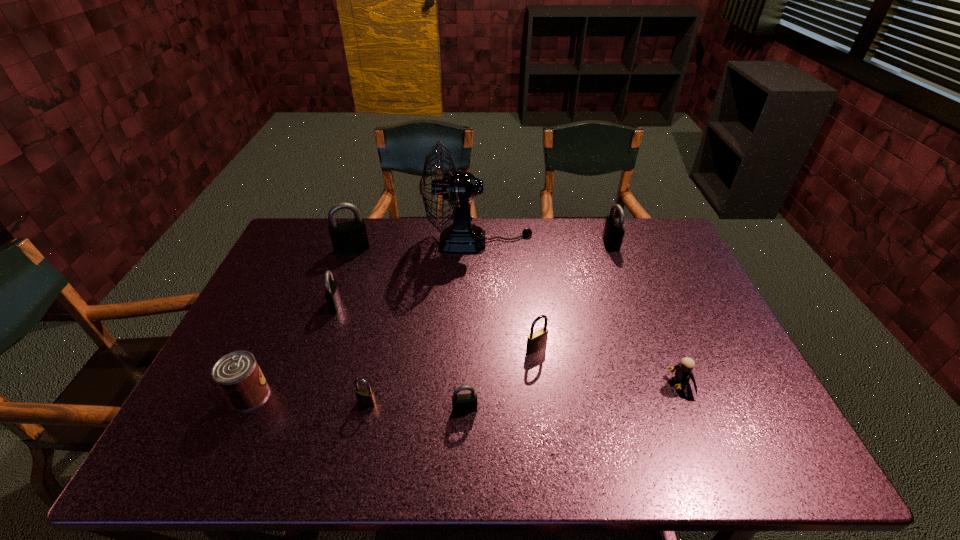
The image size is (960, 540). I want to click on black padlock that is the closest to the fourth farthest padlock, so click(464, 403).

At what (x,y) coordinates should I click in order to perform the action: click on vacant space that satisfies the following two spatial constraints: 1. on the back side of the rightmost black padlock; 2. on the right side of the bigger brass padlock. Please return your answer as a coordinate pair (x, y). Looking at the image, I should click on (523, 244).

The width and height of the screenshot is (960, 540). Find the location of `vacant space that satisfies the following two spatial constraints: 1. on the front side of the eighth shortest object; 2. on the right side of the farther brass padlock`. vacant space that satisfies the following two spatial constraints: 1. on the front side of the eighth shortest object; 2. on the right side of the farther brass padlock is located at coordinates (317, 348).

You are a GUI agent. You are given a task and a screenshot of the screen. Output one action in this format:
    pyautogui.click(x=<x>, y=<y>)
    Task: Click on the free space in the image that satisfies the following two spatial constraints: 1. on the back side of the fourth padlock from right to left; 2. on the left side of the bigger brass padlock
    
    Given the screenshot: What is the action you would take?
    pyautogui.click(x=379, y=348)